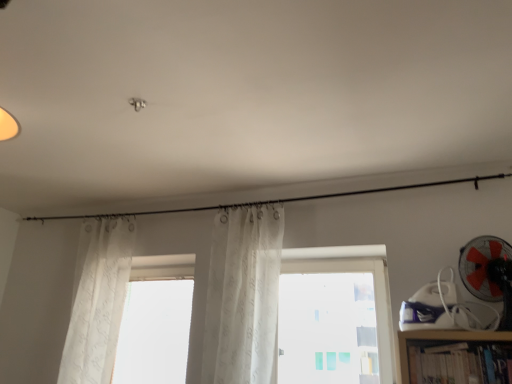
Question: In terms of size, does translucent white curtain at left, which is counted as the first curtain, starting from the left, appear bigger or smaller than white sheer curtain at center, the first curtain when ordered from right to left?

Choices:
 (A) big
 (B) small

Answer: (A)

Question: From a real-world perspective, is translucent white curtain at left, positioned as the second curtain in right-to-left order, physically located above or below white sheer curtain at center, the first curtain when ordered from right to left?

Choices:
 (A) below
 (B) above

Answer: (A)

Question: Estimate the real-world distances between objects in this image. Which object is closer to the hardcover book at lower right?

Choices:
 (A) translucent white curtain at left, positioned as the second curtain in right-to-left order
 (B) transparent glass window at center
 (C) white sheer curtain at center, the first curtain when ordered from right to left
 (D) red plastic fan at right

Answer: (D)

Question: Which object is the closest to the hardcover book at lower right?

Choices:
 (A) translucent white curtain at left, which is counted as the first curtain, starting from the left
 (B) red plastic fan at right
 (C) transparent glass window at center
 (D) white sheer curtain at center, which is the 2th curtain from left to right

Answer: (B)